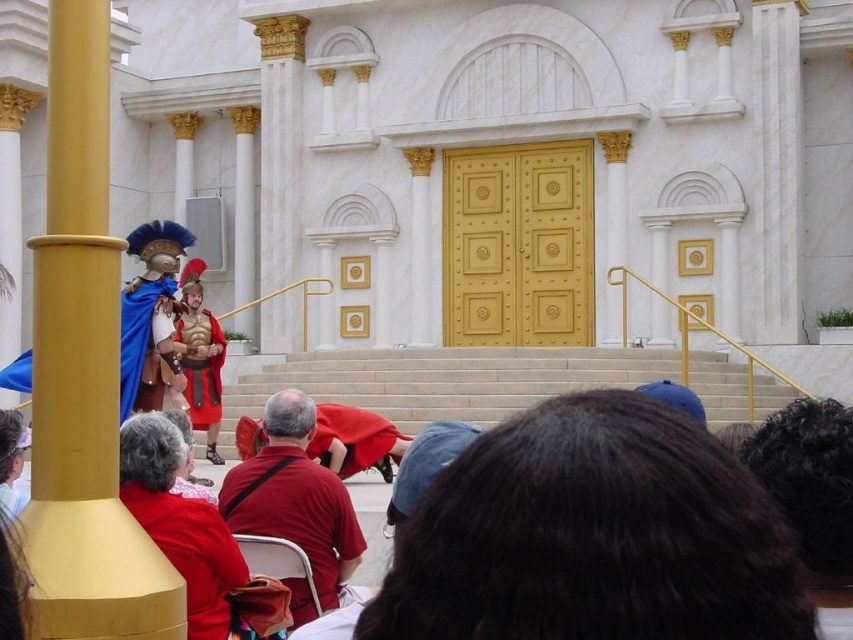
Question: Does red fabric cape at center come behind red velvet cape at center?

Choices:
 (A) yes
 (B) no

Answer: (B)

Question: Which of these objects is positioned farthest from the red fabric cape at center?

Choices:
 (A) red velvet cape at center
 (B) blue velvet cape at center
 (C) gold polished pole at left
 (D) shiny gold armor at center

Answer: (D)

Question: Can you confirm if gold polished pole at left is positioned to the left of blue velvet cape at center?

Choices:
 (A) no
 (B) yes

Answer: (A)

Question: Can you confirm if gold polished pole at left is bigger than velvet red cape at center?

Choices:
 (A) yes
 (B) no

Answer: (A)

Question: Which of the following is the farthest from the observer?

Choices:
 (A) (332, 532)
 (B) (381, 426)
 (C) (148, 401)

Answer: (B)

Question: Which point is farther from the camera taking this photo?

Choices:
 (A) (82, 285)
 (B) (357, 536)

Answer: (B)